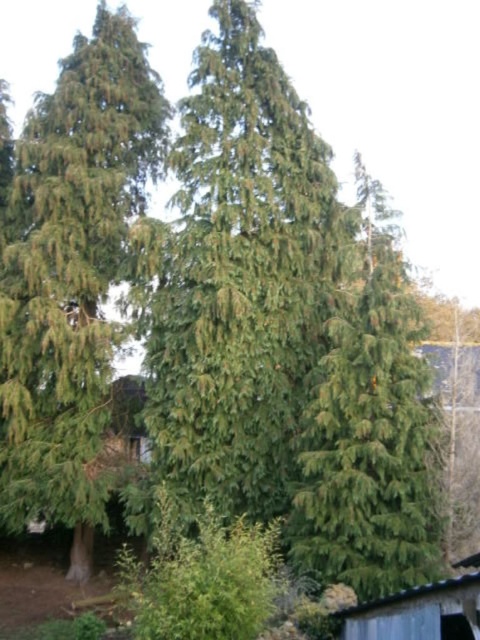
Is green needle-like at left smaller than rusty corrugated metal hut at lower right?

Actually, green needle-like at left might be larger than rusty corrugated metal hut at lower right.

Does point (137, 102) come closer to viewer compared to point (419, 614)?

No.

Where is `green needle-like at left`? The width and height of the screenshot is (480, 640). green needle-like at left is located at coordinates (71, 273).